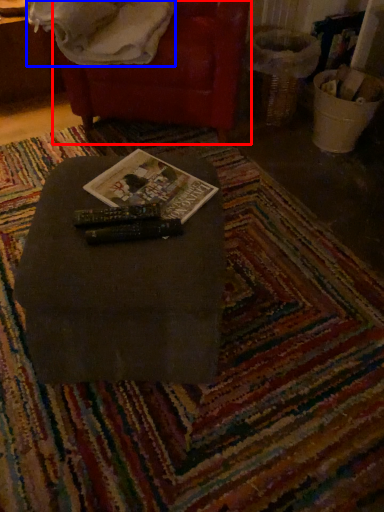
Question: Which object appears farthest to the camera in this image, bean bag chair (highlighted by a red box) or blanket (highlighted by a blue box)?

Choices:
 (A) bean bag chair
 (B) blanket

Answer: (A)